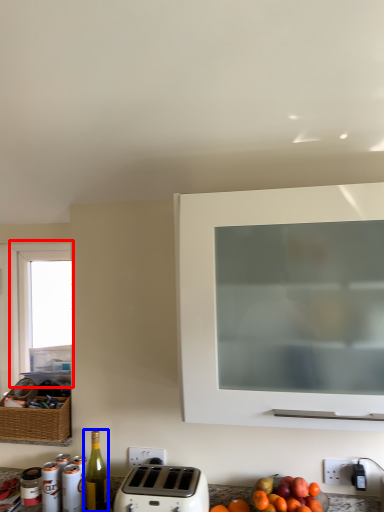
Question: Which point is further to the camera, window (highlighted by a red box) or bottle (highlighted by a blue box)?

Choices:
 (A) window
 (B) bottle

Answer: (A)